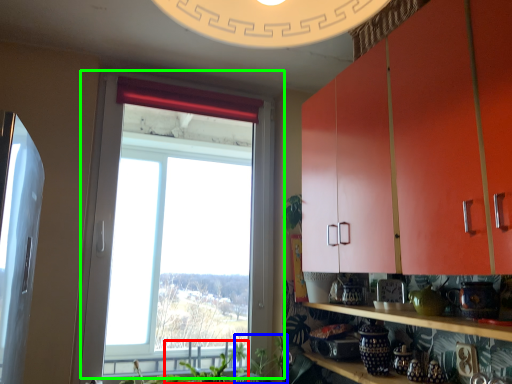
Question: Which object is positioned farthest from plant (highlighted by a red box)? Select from plant (highlighted by a blue box) and window (highlighted by a green box).

Choices:
 (A) plant
 (B) window

Answer: (B)